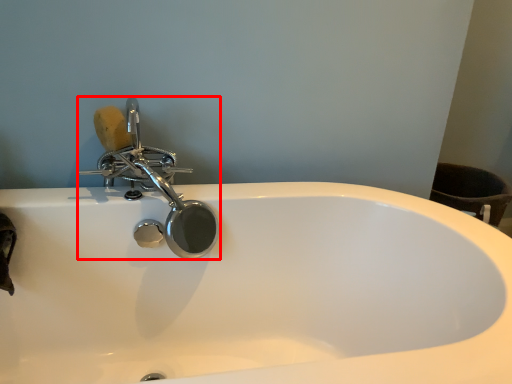
Question: From the image's perspective, where is tap (annotated by the red box) located relative to soap?

Choices:
 (A) above
 (B) below

Answer: (B)